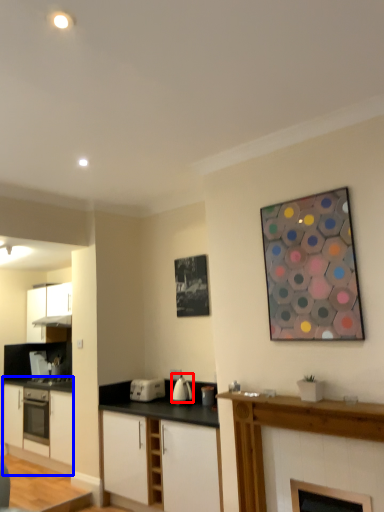
Question: Which of the following is the farthest to the observer, kitchen appliance (highlighted by a red box) or cabinetry (highlighted by a blue box)?

Choices:
 (A) kitchen appliance
 (B) cabinetry

Answer: (B)